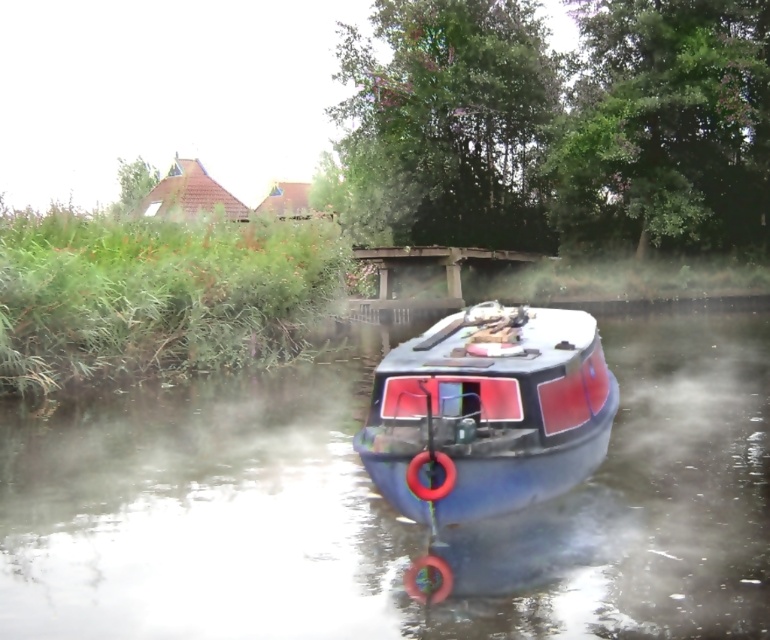
Question: Which point is farther from the camera taking this photo?

Choices:
 (A) (99, 636)
 (B) (561, 410)

Answer: (B)

Question: Can you confirm if blue rubber boat at center is smaller than blue matte boat at center?

Choices:
 (A) no
 (B) yes

Answer: (A)

Question: Is blue rubber boat at center closer to camera compared to blue matte boat at center?

Choices:
 (A) yes
 (B) no

Answer: (A)

Question: Is blue rubber boat at center to the left of blue matte boat at center from the viewer's perspective?

Choices:
 (A) no
 (B) yes

Answer: (B)

Question: Which point is closer to the camera taking this photo?

Choices:
 (A) (556, 371)
 (B) (182, 561)

Answer: (B)